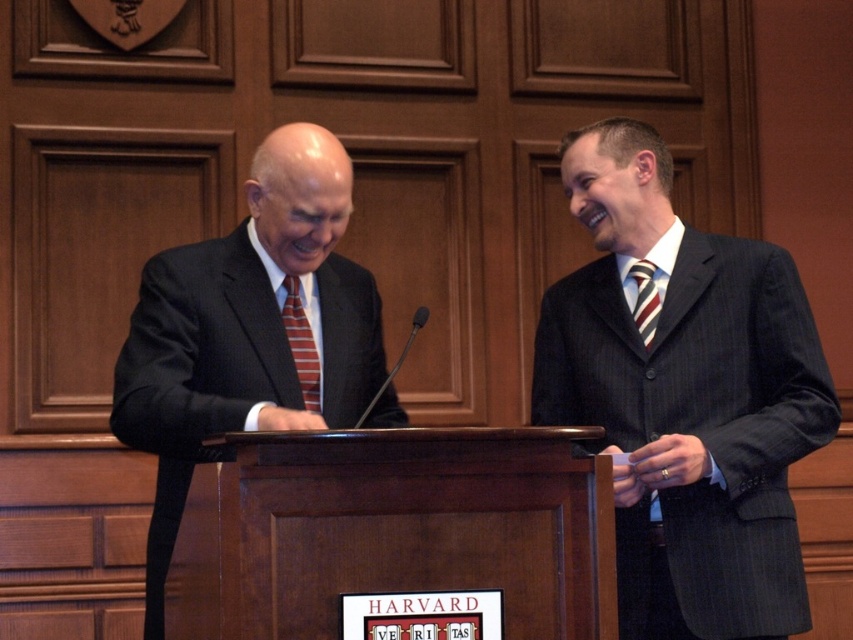
Is point (221, 397) positioned after point (654, 310)?

That is False.

Is matte black suit at center above striped fabric tie at right?

Incorrect, matte black suit at center is not positioned above striped fabric tie at right.

Is point (140, 323) in front of point (643, 324)?

Yes, it is in front of point (643, 324).

Locate an element on the screen. The image size is (853, 640). matte black suit at center is located at coordinates (247, 330).

Measure the distance between wooden podium at center and camera.

The distance of wooden podium at center from camera is 6.47 feet.

Does wooden podium at center have a larger size compared to striped fabric tie at left?

Yes.

Who is more distant from viewer, (x=337, y=454) or (x=311, y=360)?

The point (x=311, y=360) is behind.

Locate an element on the screen. This screenshot has height=640, width=853. wooden podium at center is located at coordinates (415, 525).

Does matte black suit at center have a greater width compared to striped fabric tie at left?

Yes, matte black suit at center is wider than striped fabric tie at left.

Between point (254, 161) and point (312, 349), which one is positioned in front?

Point (254, 161) is in front.

At what (x,y) coordinates should I click in order to perform the action: click on matte black suit at center. Please return your answer as a coordinate pair (x, y). Looking at the image, I should click on (247, 330).